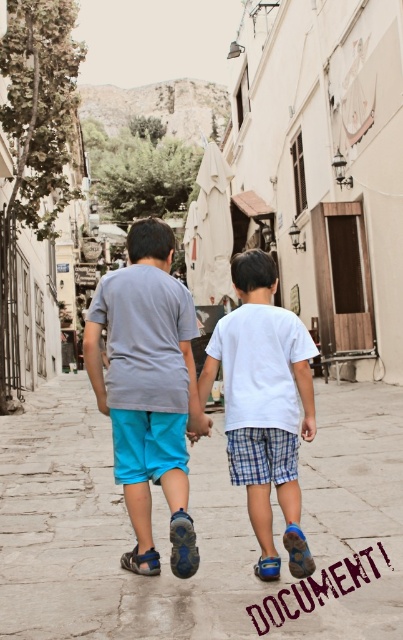
Looking at this image, you are a photographer trying to capture the two boys walking down the cobblestone street. You notice a specific point marked at coordinates (147, 388). What object is located at that point?

The matte gray tshirt at center is located at point (147, 388).

You are a photographer trying to capture the boys walking down the street. You want to ensure the white cotton shirt at center and the smooth stone pavement at center are both clearly visible in your shot. Based on their positions, which object should you focus on first to ensure both are in focus?

The smooth stone pavement at center is positioned under the white cotton shirt at center, so focusing on the white cotton shirt at center first will ensure both are in focus since the pavement is behind it.